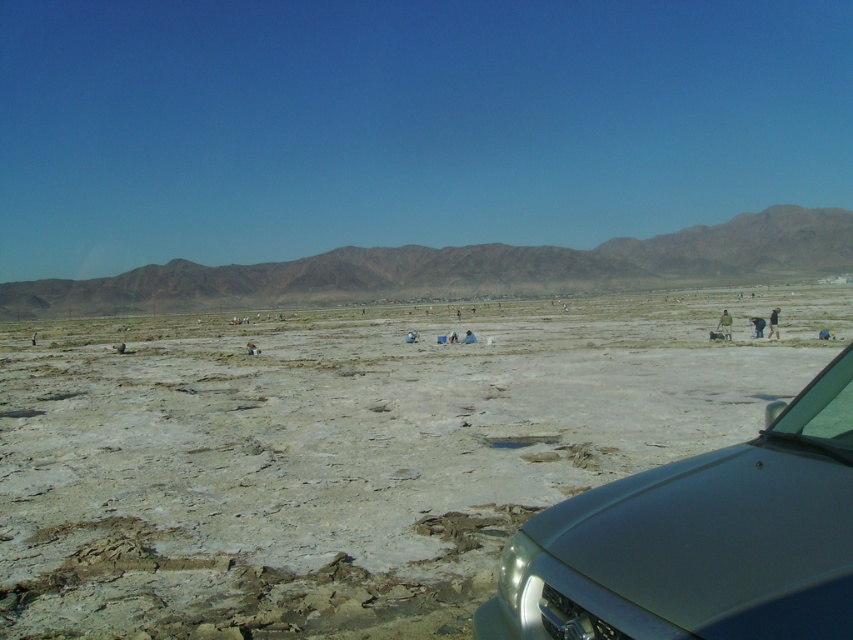
Question: Can you confirm if brown fabric person at lower right is positioned to the right of dark blue jeans at center?

Choices:
 (A) no
 (B) yes

Answer: (A)

Question: Is satin silver car at lower right bigger than dark blue jeans at center?

Choices:
 (A) no
 (B) yes

Answer: (A)

Question: Which of these objects is positioned closest to the brown rocky mountain at upper center?

Choices:
 (A) dark blue jeans at center
 (B) satin silver car at lower right
 (C) gray sandy dirt field at center

Answer: (C)

Question: Among these objects, which one is nearest to the camera?

Choices:
 (A) brown rocky mountain at upper center
 (B) brown fabric person at lower right
 (C) satin silver car at lower right
 (D) dark blue jeans at center

Answer: (C)

Question: Which point is farther from the camera taking this photo?

Choices:
 (A) (788, 404)
 (B) (722, 310)
 (C) (791, 205)
 (D) (357, 452)

Answer: (C)

Question: Can you confirm if brown fabric person at lower right is bigger than dark blue jeans at center?

Choices:
 (A) no
 (B) yes

Answer: (A)